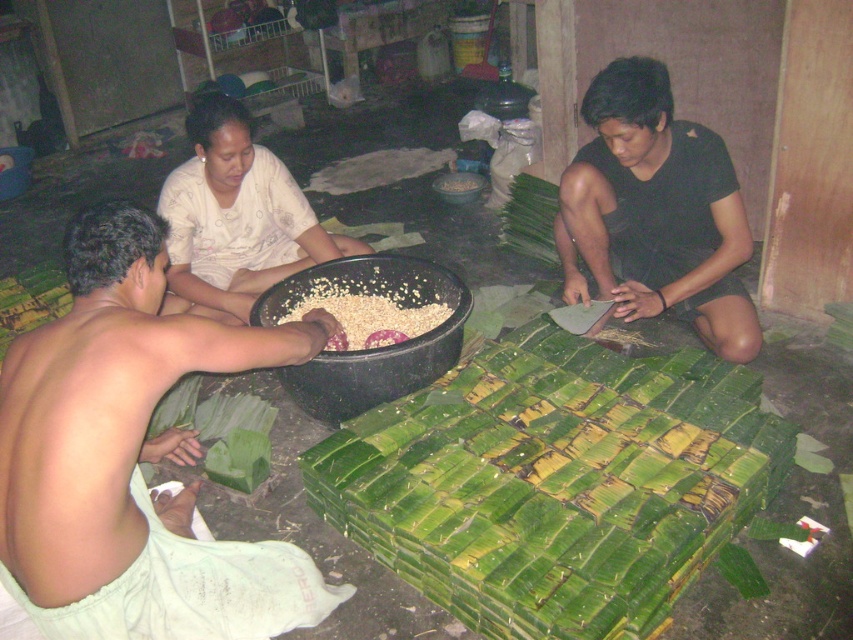
Looking at the scene, which object is larger between the green leafy bundle at center and the white grainy rice at center?

The green leafy bundle at center is bigger than the white grainy rice at center.

You are a chef preparing a dish and need to choose between the green leafy bundle at center and the white grainy rice at center based on their sizes. Which one is wider?

Result: The green leafy bundle at center is wider than the white grainy rice at center.

You are helping prepare food in the scene. You need to cover the green leafy bundle at center and white fabric at center with a lid. Which one can be covered without moving the other?

The white fabric at center can be covered without moving the green leafy bundle at center because it is smaller in size.